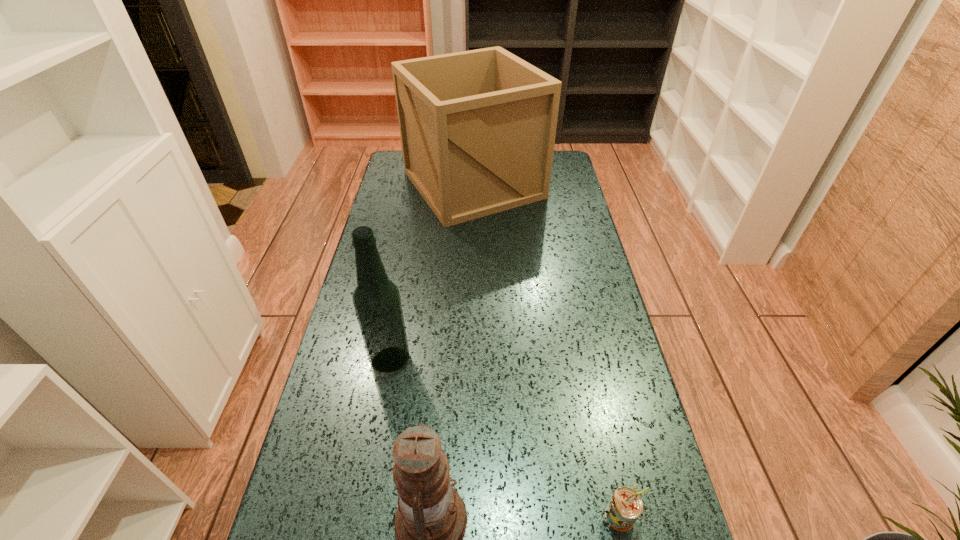
Locate an element on the screen. This screenshot has width=960, height=540. box is located at coordinates (477, 128).

The image size is (960, 540). I want to click on the third nearest object, so (376, 299).

Where is `can`? can is located at coordinates (625, 506).

This screenshot has height=540, width=960. Identify the location of free space located 0.120m on the right of the farthest object. (575, 184).

Identify the location of blank space located on the back of the alcohol. tap(405, 278).

Locate an element on the screen. vacant area situated on the back of the can is located at coordinates (585, 349).

This screenshot has height=540, width=960. Identify the location of object at the far edge. (477, 128).

The width and height of the screenshot is (960, 540). In order to click on box at the left edge in this screenshot , I will do `click(477, 128)`.

This screenshot has width=960, height=540. Find the location of `alcohol located in the left edge section of the desktop`. alcohol located in the left edge section of the desktop is located at coordinates (376, 299).

The width and height of the screenshot is (960, 540). Find the location of `box that is at the right edge`. box that is at the right edge is located at coordinates (477, 128).